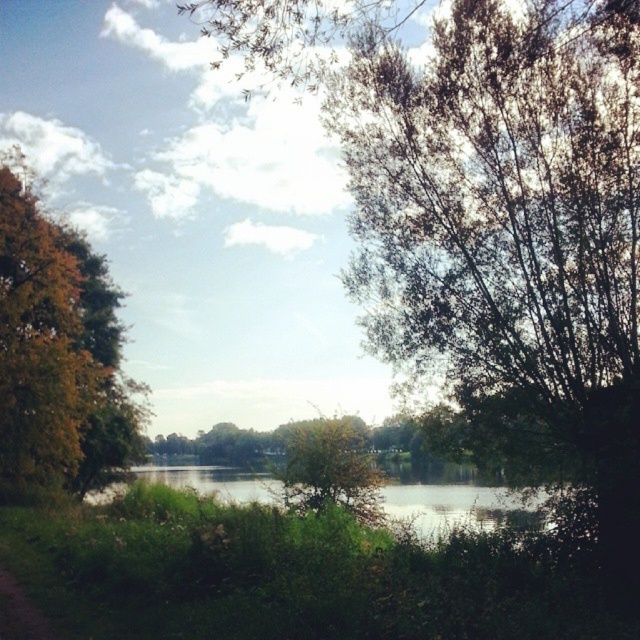
Based on the scene description, can you identify the object located at the coordinate point (58,355)?

The point (58,355) corresponds to the orange leafy tree at left.

You are standing at the edge of the scene and want to cross the green grassy river at center. Which direction should you walk to reach it?

To reach the green grassy river at center, you should walk towards the center of the scene since it is located at point coordinates approximately 0.784 on the x and 0.717 on the y axis, which is centrally positioned.